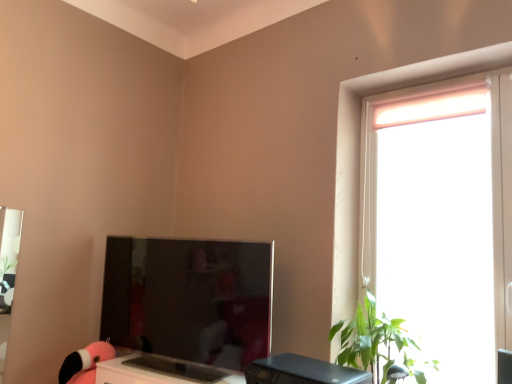
This screenshot has height=384, width=512. In order to click on empty space that is ontop of translucent plastic window at right (from a real-world perspective) in this screenshot , I will do `click(436, 72)`.